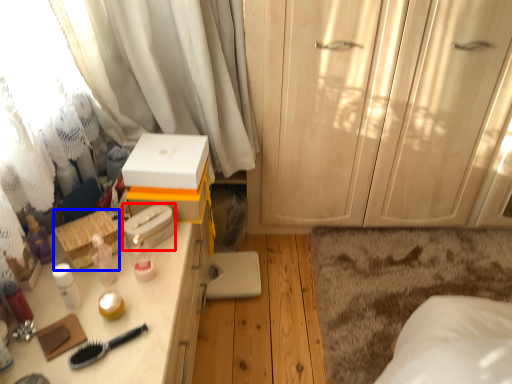
Question: Which of the following is the closest to the observer, storage box (highlighted by a red box) or storage box (highlighted by a blue box)?

Choices:
 (A) storage box
 (B) storage box

Answer: (B)